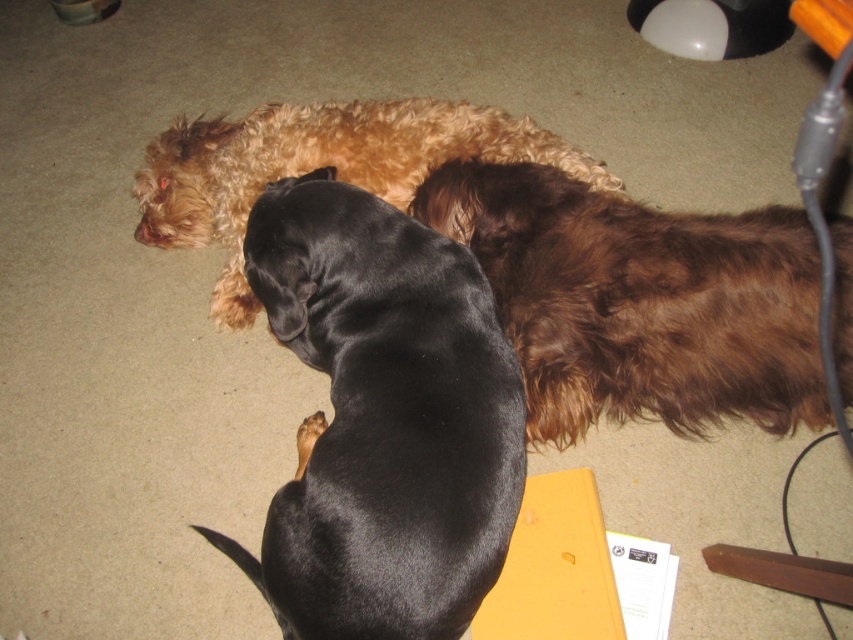
Is point (764, 221) closer to camera compared to point (381, 166)?

Yes.

Is brown fuzzy dog at center in front of golden brown fur at center?

Yes, it is in front of golden brown fur at center.

Is point (502, 246) less distant than point (283, 163)?

Yes.

Find the location of a particular element. Image resolution: width=853 pixels, height=640 pixels. brown fuzzy dog at center is located at coordinates coord(639,301).

Does black shiny dog at center have a smaller size compared to brown fuzzy dog at center?

No.

Who is positioned more to the left, black shiny dog at center or brown fuzzy dog at center?

black shiny dog at center is more to the left.

Is point (335, 253) in front of point (627, 200)?

Yes, point (335, 253) is closer to viewer.

The image size is (853, 640). I want to click on black shiny dog at center, so click(x=383, y=420).

Does black shiny dog at center have a larger size compared to golden brown fur at center?

No.

Who is more distant from viewer, (480, 465) or (389, 193)?

Point (389, 193)

Is point (320, 182) farther from camera compared to point (393, 147)?

No, (320, 182) is closer to viewer.

Locate an element on the screen. black shiny dog at center is located at coordinates click(x=383, y=420).